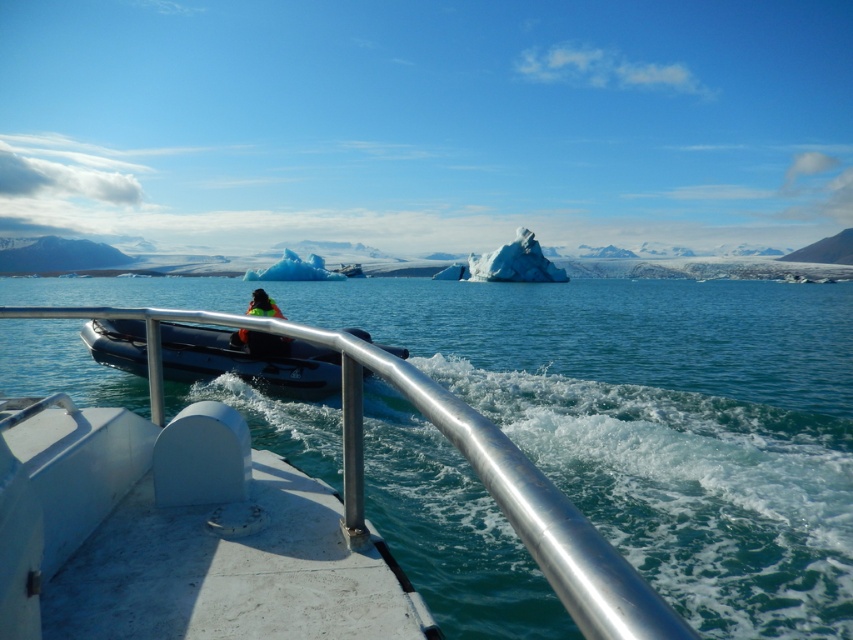
Question: Which point is farther to the camera?

Choices:
 (A) clear blue water at center
 (B) silver metallic rail at center
 (C) rubberized black boat at center

Answer: (C)

Question: Which is farther from the rubberized black boat at center?

Choices:
 (A) clear blue water at center
 (B) silver metallic rail at center

Answer: (A)

Question: From the image, what is the correct spatial relationship of clear blue water at center in relation to rubberized black boat at center?

Choices:
 (A) right
 (B) left

Answer: (A)

Question: Does clear blue water at center appear on the right side of rubberized black boat at center?

Choices:
 (A) yes
 (B) no

Answer: (A)

Question: Does clear blue water at center have a lesser width compared to neon green life vest at center?

Choices:
 (A) no
 (B) yes

Answer: (A)

Question: Considering the real-world distances, which object is closest to the neon green life vest at center?

Choices:
 (A) rubberized black boat at center
 (B) clear blue water at center
 (C) silver metallic rail at center

Answer: (A)